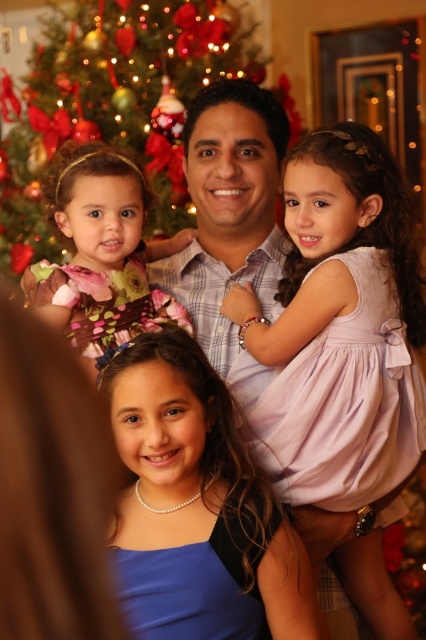
Is point (382, 388) more distant than point (195, 598)?

Yes, it is behind point (195, 598).

Describe the element at coordinates (336, 284) in the screenshot. I see `pink satin dress at center` at that location.

The height and width of the screenshot is (640, 426). I want to click on pink satin dress at center, so click(336, 284).

The width and height of the screenshot is (426, 640). What do you see at coordinates (199, 499) in the screenshot? I see `blue satin dress at center` at bounding box center [199, 499].

Is blue satin dress at center behind floral dress at upper left?

That is False.

I want to click on blue satin dress at center, so click(x=199, y=499).

Is decorated christmas tree at upper left below floral dress at upper left?

No, decorated christmas tree at upper left is not below floral dress at upper left.

Between point (45, 83) and point (69, 172), which one is positioned in front?

Point (69, 172)

Locate an element on the screen. The width and height of the screenshot is (426, 640). decorated christmas tree at upper left is located at coordinates (112, 102).